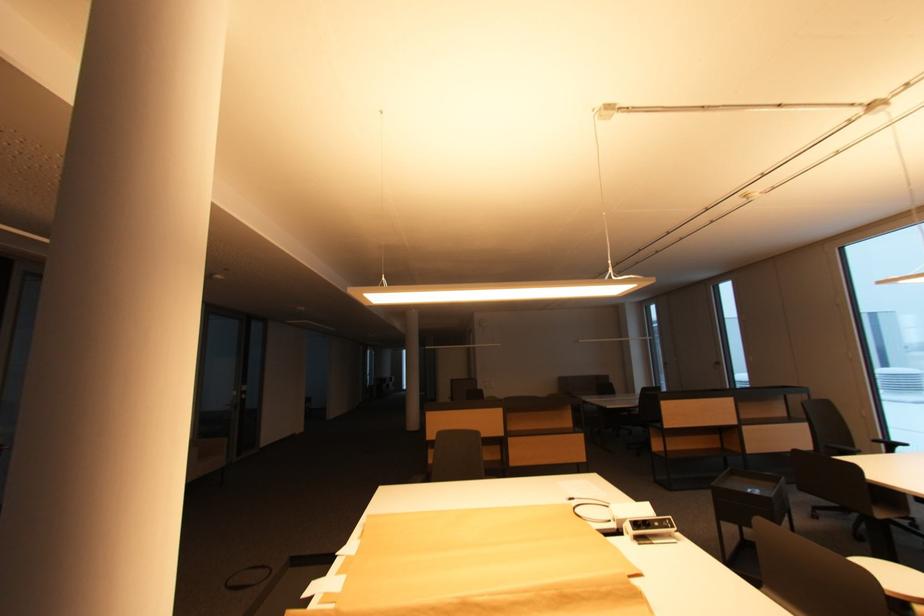
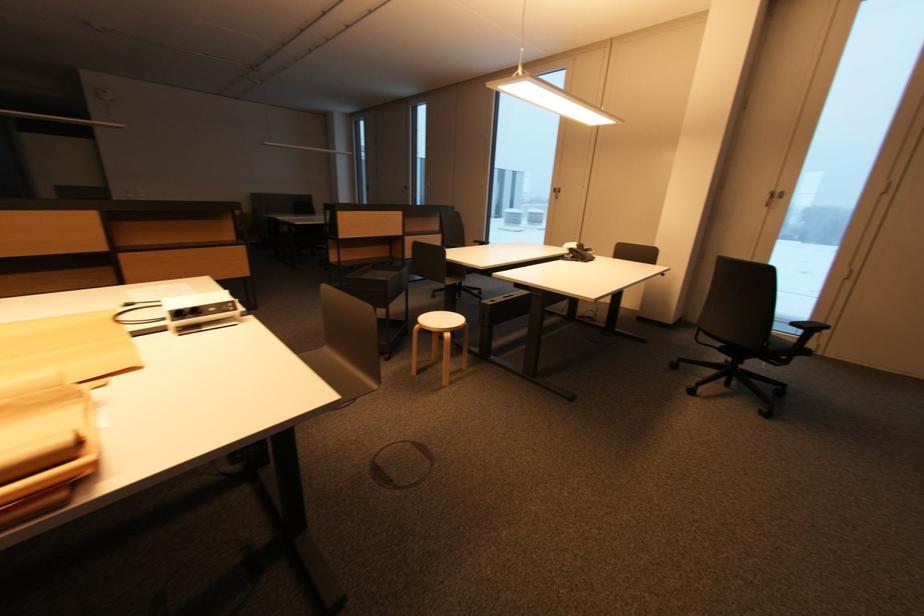
The images are taken continuously from a first-person perspective. In which direction is your viewpoint rotating?

The camera's rotation is toward right-down.